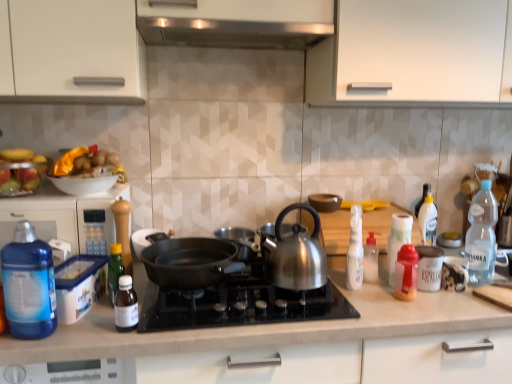
I want to click on vacant area to the right of blue translucent bottle at left, the 8th bottle when ordered from right to left, so (92, 332).